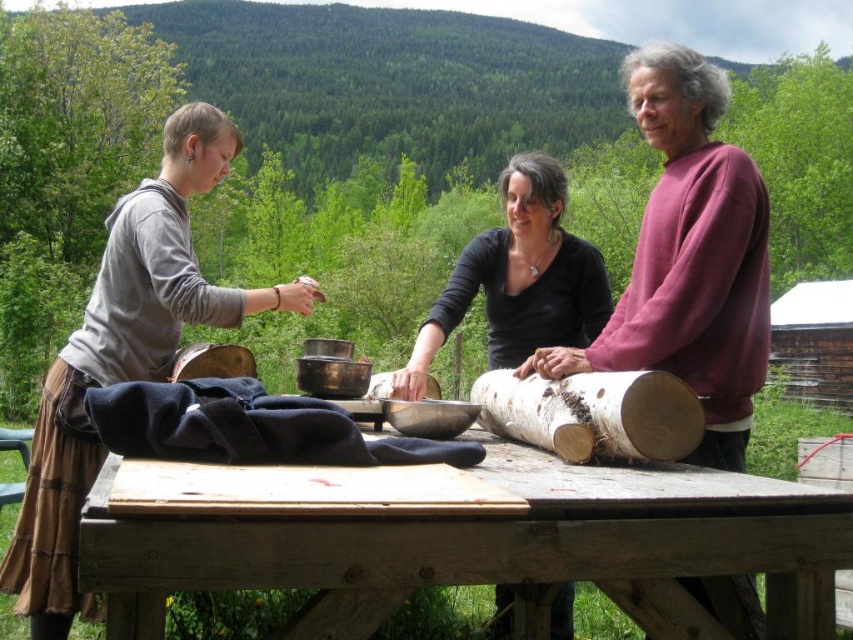
Question: Does purple cotton sweater at upper right appear on the left side of bark wood log at center?

Choices:
 (A) no
 (B) yes

Answer: (A)

Question: Which object is closer to the camera taking this photo?

Choices:
 (A) black matte shirt at center
 (B) wooden at center
 (C) bark wood log at center

Answer: (B)

Question: Does purple cotton sweater at upper right appear over black matte shirt at center?

Choices:
 (A) no
 (B) yes

Answer: (A)

Question: Is purple cotton sweater at upper right further to camera compared to black matte shirt at center?

Choices:
 (A) no
 (B) yes

Answer: (A)

Question: Based on their relative distances, which object is nearer to the bark wood log at center?

Choices:
 (A) black matte shirt at center
 (B) purple cotton sweater at upper right
 (C) wooden at center

Answer: (B)

Question: Among these objects, which one is farthest from the camera?

Choices:
 (A) purple cotton sweater at upper right
 (B) wooden at center
 (C) bark wood log at center

Answer: (A)